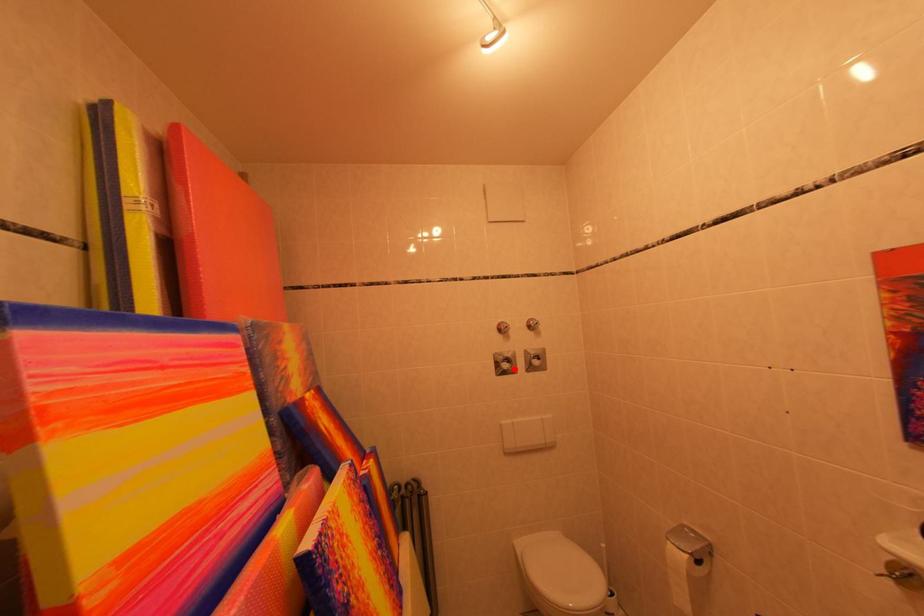
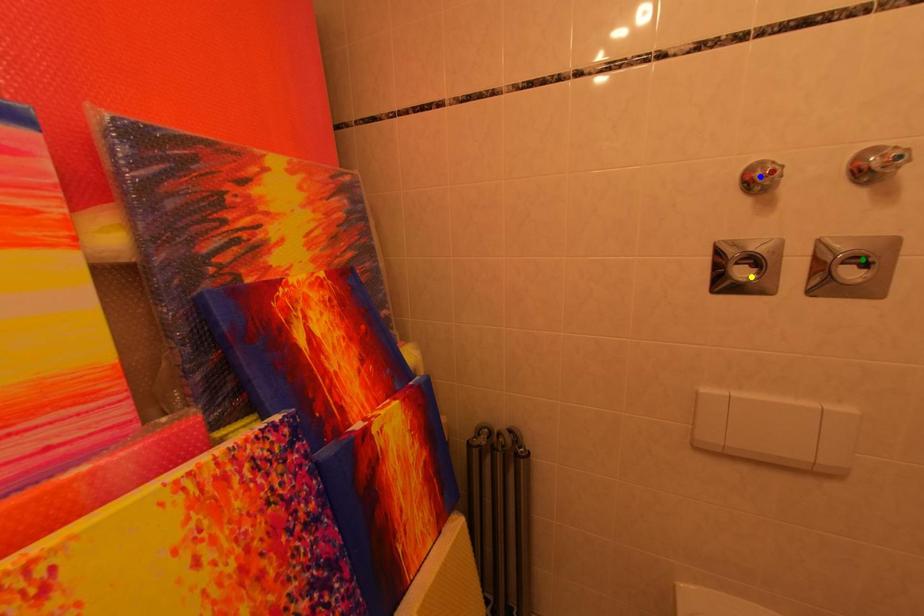
Question: I am providing you with two images of the same scene from different viewpoints. A red point is marked on the first image. You are given multiple points on the second image. Which spot in image 2 lines up with the point in image 1?

Choices:
 (A) yellow point
 (B) green point
 (C) blue point

Answer: (A)